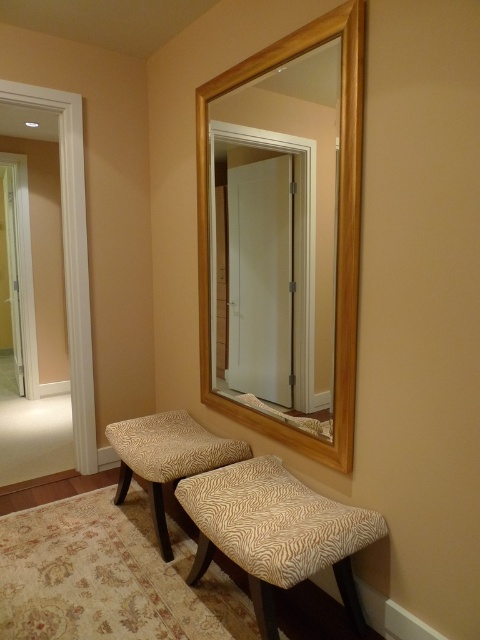
Question: Which object is the closest to the zebra-patterned fabric stool at center?

Choices:
 (A) zebra-patterned fabric stool at lower center
 (B) wooden mirror at center

Answer: (B)

Question: Which is farther from the zebra-patterned fabric stool at lower center?

Choices:
 (A) zebra-patterned fabric stool at center
 (B) wooden mirror at center

Answer: (A)

Question: Is zebra-patterned fabric stool at lower center below zebra-patterned fabric stool at center?

Choices:
 (A) yes
 (B) no

Answer: (A)

Question: Is wooden mirror at center closer to the viewer compared to zebra-patterned fabric stool at lower center?

Choices:
 (A) yes
 (B) no

Answer: (B)

Question: Among these points, which one is farthest from the camera?

Choices:
 (A) (240, 486)
 (B) (116, 435)
 (C) (356, 324)

Answer: (B)

Question: Is zebra-patterned fabric stool at lower center positioned at the back of zebra-patterned fabric stool at center?

Choices:
 (A) yes
 (B) no

Answer: (B)